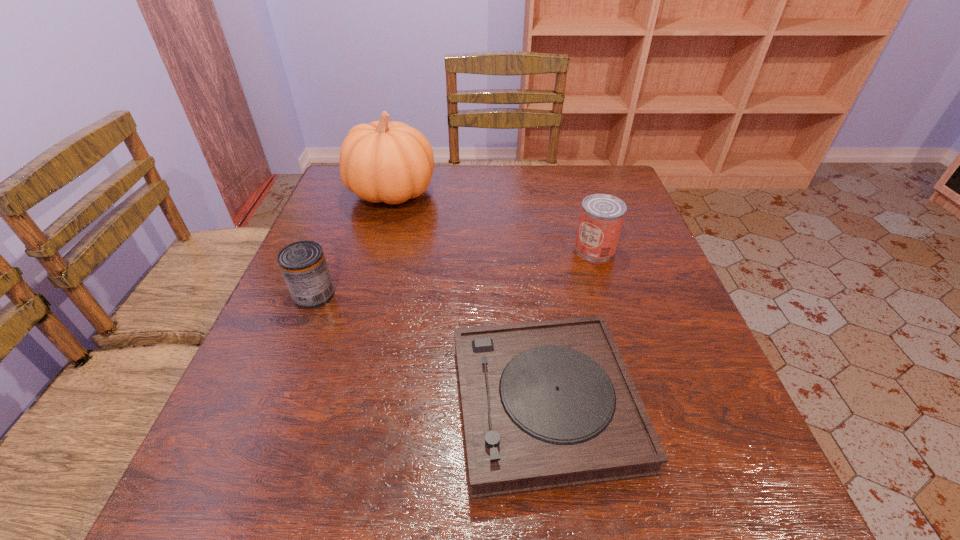
The height and width of the screenshot is (540, 960). Identify the location of free space at the far edge of the desktop. (456, 206).

Find the location of a particular element. free point at the near edge is located at coordinates (506, 527).

Identify the location of vacant region at the left edge of the desktop. (255, 390).

Where is `vacant space at the right edge of the desktop`? vacant space at the right edge of the desktop is located at coordinates (622, 340).

Locate an element on the screen. vacant space at the far left corner is located at coordinates (x=336, y=194).

Locate an element on the screen. The height and width of the screenshot is (540, 960). blank area at the far right corner is located at coordinates (x=577, y=182).

This screenshot has width=960, height=540. I want to click on vacant space that is in between the second nearest object and the second farthest object, so click(455, 271).

Locate an element on the screen. Image resolution: width=960 pixels, height=540 pixels. free spot between the left can and the shortest object is located at coordinates (429, 349).

Find the location of `vacant space in between the shortest object and the third farthest object`. vacant space in between the shortest object and the third farthest object is located at coordinates (429, 349).

Find the location of a particular element. The image size is (960, 540). free point between the nearer can and the right can is located at coordinates (455, 271).